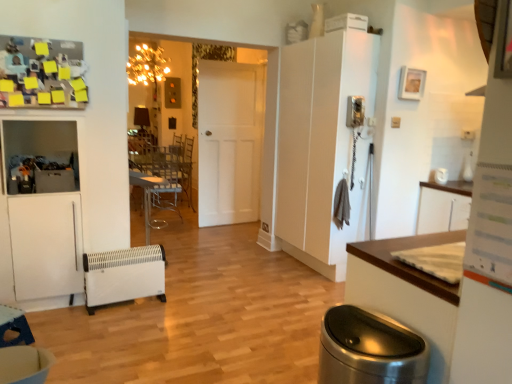
The width and height of the screenshot is (512, 384). I want to click on free space to the left of white matte cabinet at right, so click(241, 269).